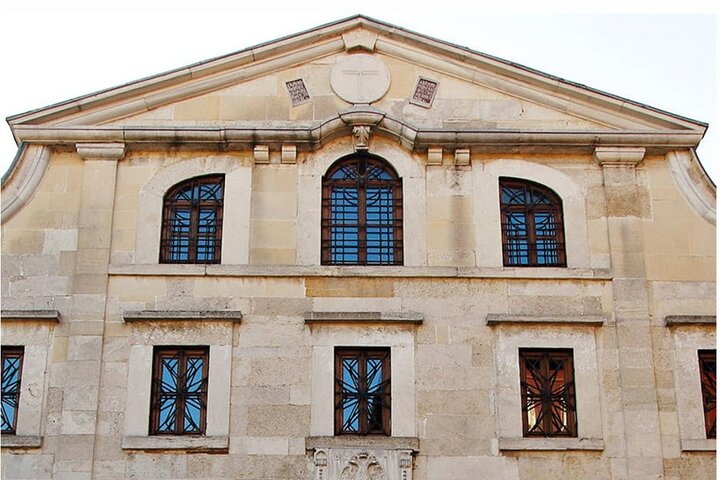
Identify the location of window frame. (409, 382), (585, 369), (682, 377), (227, 372), (24, 378), (234, 203), (417, 213), (577, 233).